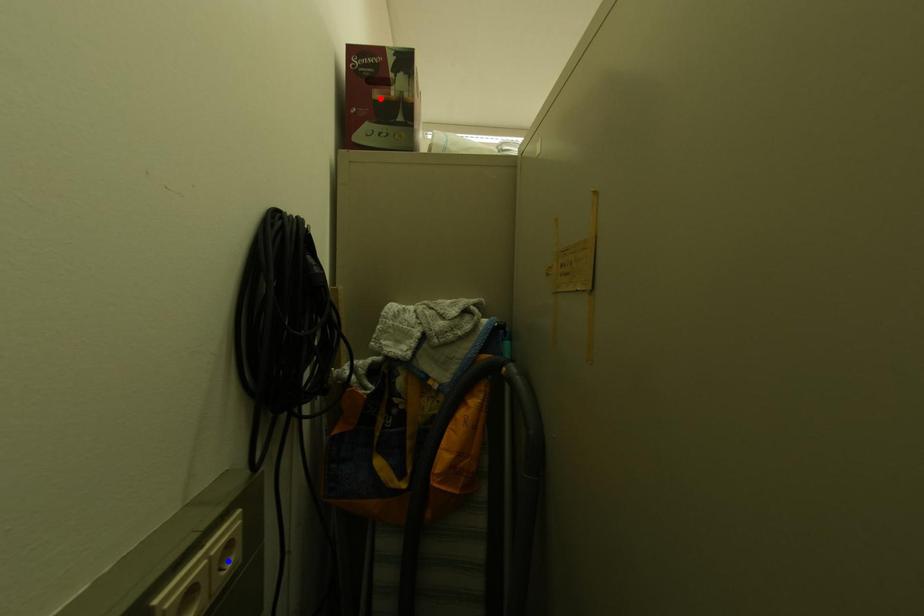
Question: Two points are marked on the image. Which point is closer to the camera?

Choices:
 (A) Blue point is closer.
 (B) Red point is closer.

Answer: (A)